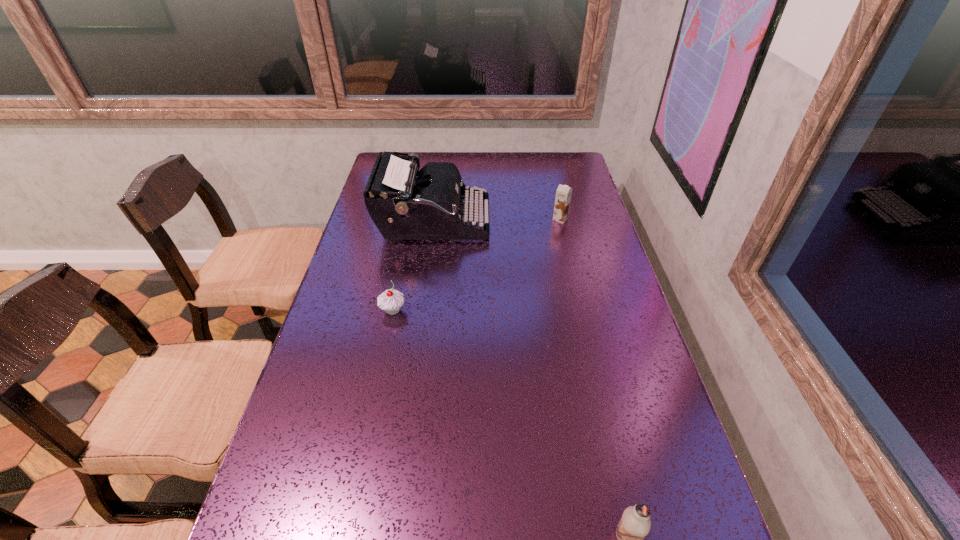
I want to click on free space at the left edge, so click(318, 443).

In the image, there is a desktop. Identify the location of vacant space at the right edge. The height and width of the screenshot is (540, 960). (564, 180).

Where is `unoccupied position between the farther chocolate milk and the cupcake`? The image size is (960, 540). unoccupied position between the farther chocolate milk and the cupcake is located at coordinates (477, 265).

What are the coordinates of `free area in between the farther chocolate milk and the cupcake` in the screenshot? It's located at (477, 265).

The image size is (960, 540). I want to click on free space that is in between the typewriter and the farther chocolate milk, so click(496, 220).

This screenshot has height=540, width=960. I want to click on vacant space that's between the farther chocolate milk and the third farthest object, so click(x=477, y=265).

Where is `vacant area between the typewriter and the farther chocolate milk`? vacant area between the typewriter and the farther chocolate milk is located at coordinates (496, 220).

Locate an element on the screen. vacant point located between the cupcake and the farther chocolate milk is located at coordinates (477, 265).

At what (x,y) coordinates should I click in order to perform the action: click on object that is the second nearest to the cupcake. Please return your answer as a coordinate pair (x, y). The width and height of the screenshot is (960, 540). Looking at the image, I should click on (563, 193).

Find the location of a particular element. the closest object to the farther chocolate milk is located at coordinates (405, 203).